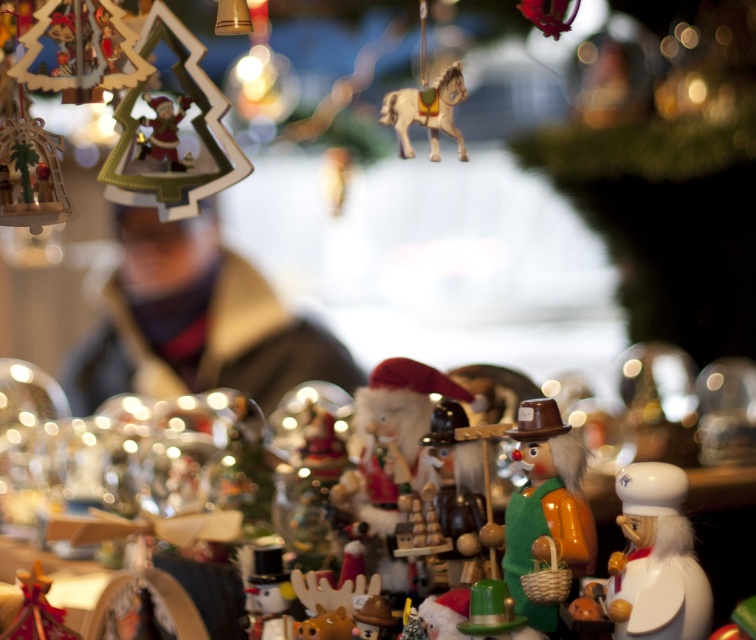
You are a customer at the Christmas market and see the wooden nutcracker at center and the wooden clown at center. Which one is located to the right?

The wooden nutcracker at center is positioned to the right of the wooden clown at center, so the wooden nutcracker at center is located to the right.

You are at a Christmas market and see the wooden nutcracker at center and the wooden clown at center. Which one is positioned higher?

The wooden nutcracker at center is located above the wooden clown at center, so it is positioned higher.

Consider the image. You are setting up a display for a holiday market and need to arrange the shiny gold horse at upper center and the matte plastic santa at upper left. Based on their sizes, which one should be placed on the higher shelf to ensure visibility?

The shiny gold horse at upper center should be placed on the higher shelf because it is much taller than the matte plastic santa at upper left, ensuring it is visible from below.